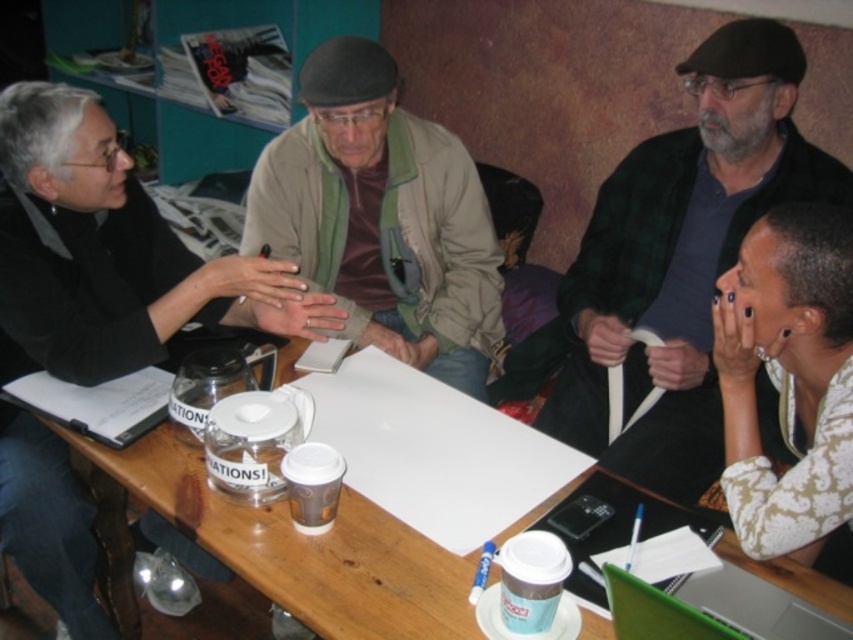
Question: Estimate the real-world distances between objects in this image. Which object is farther from the beige woolen sweater at center?

Choices:
 (A) green plaid jacket at upper right
 (B) wooden table at center
 (C) green matte laptop at lower right
 (D) beige fabric jacket at center

Answer: (C)

Question: From the image, what is the correct spatial relationship of wooden table at center in relation to white patterned shirt at lower right?

Choices:
 (A) above
 (B) below

Answer: (B)

Question: Which of these objects is positioned farthest from the beige woolen sweater at center?

Choices:
 (A) white patterned shirt at lower right
 (B) green matte laptop at lower right

Answer: (B)

Question: Is beige fabric jacket at center closer to the viewer compared to white patterned shirt at lower right?

Choices:
 (A) yes
 (B) no

Answer: (B)

Question: Which point is closer to the camera?

Choices:
 (A) beige woolen sweater at center
 (B) white patterned shirt at lower right
 (C) wooden table at center

Answer: (C)

Question: Does beige woolen sweater at center appear on the left side of beige fabric jacket at center?

Choices:
 (A) no
 (B) yes

Answer: (B)